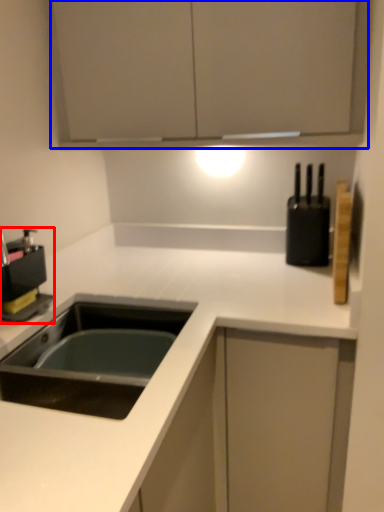
Question: Which point is further to the camera, coffee machine (highlighted by a red box) or cabinetry (highlighted by a blue box)?

Choices:
 (A) coffee machine
 (B) cabinetry

Answer: (A)